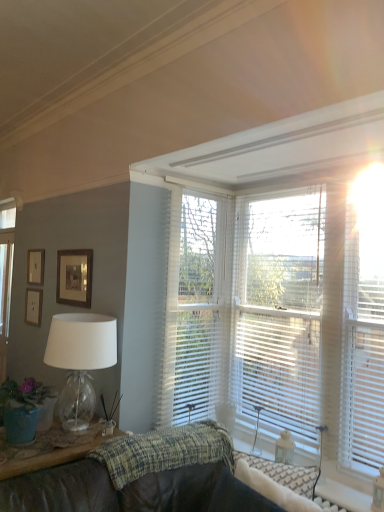
Question: Is wooden framed picture at upper left, which is the first picture frame in front-to-back order, wider or thinner than wooden picture frame at upper left, which is the 1th picture frame from left to right?

Choices:
 (A) thin
 (B) wide

Answer: (A)

Question: In the image, is wooden framed picture at upper left, which is the 3th picture frame from left to right, positioned in front of or behind wooden picture frame at upper left, marked as the 3th picture frame in a front-to-back arrangement?

Choices:
 (A) front
 (B) behind

Answer: (A)

Question: Which is nearer to the matte green pot at lower left?

Choices:
 (A) transparent glass lamp at left
 (B) translucent white blinds at upper right
 (C) clear glass door at left
 (D) wooden picture frame at upper left, which is counted as the 1th picture frame, starting from the back
 (E) wooden picture frame at upper left, which appears as the second picture frame when viewed from the back

Answer: (A)

Question: Which object is the farthest from the transparent glass lamp at left?

Choices:
 (A) matte green pot at lower left
 (B) clear glass door at left
 (C) translucent white blinds at upper right
 (D) white textured blinds at upper right
 (E) wooden picture frame at upper left, which appears as the second picture frame when viewed from the back

Answer: (B)